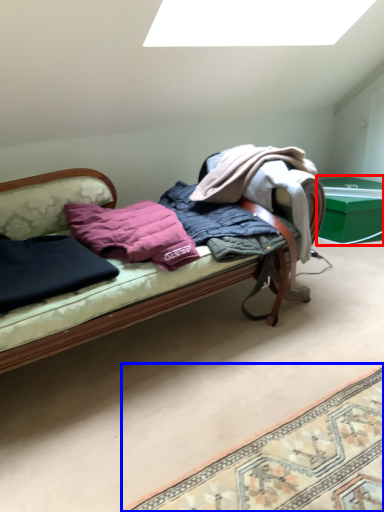
Question: Which object is closer to the camera taking this photo, table (highlighted by a red box) or mat (highlighted by a blue box)?

Choices:
 (A) table
 (B) mat

Answer: (B)